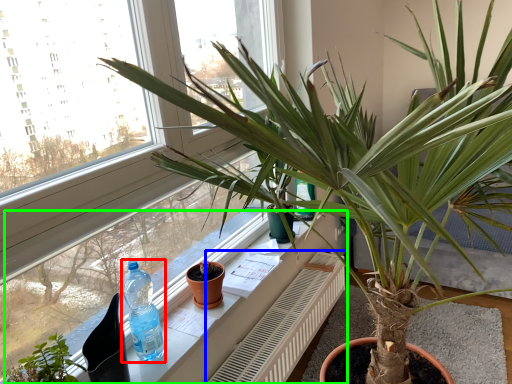
Question: Estimate the real-world distances between objects in this image. Which object is closer to bottle (highlighted by a red box), radiator (highlighted by a blue box) or window sill (highlighted by a green box)?

Choices:
 (A) radiator
 (B) window sill

Answer: (B)